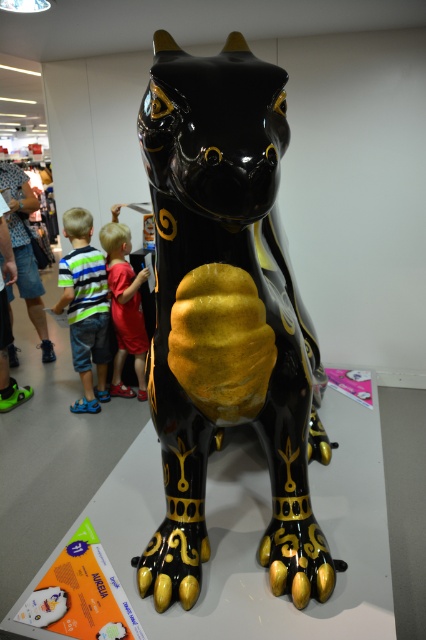
Question: Is glossy black and gold statue at center bigger than red shirt at center?

Choices:
 (A) no
 (B) yes

Answer: (B)

Question: Is glossy black and gold statue at center to the right of striped fabric shirt at lower left from the viewer's perspective?

Choices:
 (A) yes
 (B) no

Answer: (A)

Question: Which of the following is the closest to the observer?

Choices:
 (A) (273, 406)
 (B) (89, 228)
 (C) (123, 241)

Answer: (A)

Question: Is striped fabric shirt at lower left behind red shirt at center?

Choices:
 (A) no
 (B) yes

Answer: (A)

Question: Which point is farther from the camera taking this photo?

Choices:
 (A) (175, 522)
 (B) (74, 337)

Answer: (B)

Question: Which object is positioned closest to the striped fabric shirt at lower left?

Choices:
 (A) red shirt at center
 (B) glossy black and gold statue at center

Answer: (A)